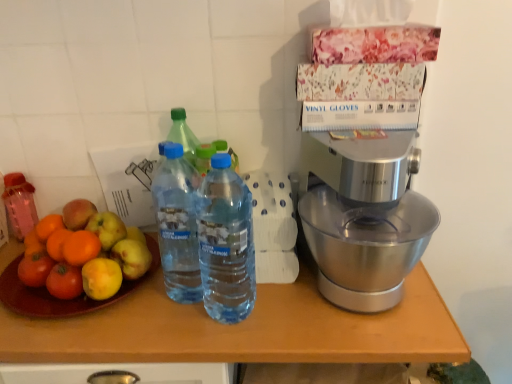
Question: Is blue plastic bottle at center, which is counted as the second bottle, starting from the back, smaller than pink translucent bottle at left, arranged as the third bottle when viewed from the right?

Choices:
 (A) yes
 (B) no

Answer: (B)

Question: Is blue plastic bottle at center, placed as the second bottle when sorted from right to left, facing away from pink translucent bottle at left, placed as the 1th bottle when sorted from left to right?

Choices:
 (A) no
 (B) yes

Answer: (A)

Question: Could you tell me if blue plastic bottle at center, placed as the second bottle when sorted from right to left, is facing pink translucent bottle at left, arranged as the third bottle when viewed from the right?

Choices:
 (A) no
 (B) yes

Answer: (A)

Question: Would you say blue plastic bottle at center, positioned as the second bottle in left-to-right order, is outside pink translucent bottle at left, arranged as the third bottle when viewed from the right?

Choices:
 (A) yes
 (B) no

Answer: (A)

Question: Is the position of blue plastic bottle at center, which is counted as the second bottle, starting from the back, less distant than that of pink translucent bottle at left, placed as the 1th bottle when sorted from left to right?

Choices:
 (A) yes
 (B) no

Answer: (A)

Question: Would you say blue plastic bottle at center, placed as the second bottle when sorted from right to left, is to the left or to the right of silver metallic mixer at right in the picture?

Choices:
 (A) right
 (B) left

Answer: (B)

Question: Does point (201, 294) appear closer or farther from the camera than point (322, 137)?

Choices:
 (A) closer
 (B) farther

Answer: (B)

Question: From the image's perspective, is blue plastic bottle at center, placed as the second bottle when sorted from front to back, above or below silver metallic mixer at right?

Choices:
 (A) below
 (B) above

Answer: (A)

Question: Is blue plastic bottle at center, which is counted as the second bottle, starting from the back, wider or thinner than silver metallic mixer at right?

Choices:
 (A) thin
 (B) wide

Answer: (A)

Question: In the image, is silver metallic mixer at right positioned in front of or behind transparent plastic bottle at center, which is counted as the 3th bottle, starting from the left?

Choices:
 (A) behind
 (B) front

Answer: (A)

Question: Considering the positions of silver metallic mixer at right and transparent plastic bottle at center, the first bottle positioned from the right, in the image, is silver metallic mixer at right taller or shorter than transparent plastic bottle at center, the first bottle positioned from the right,?

Choices:
 (A) short
 (B) tall

Answer: (A)

Question: In terms of width, does silver metallic mixer at right look wider or thinner when compared to transparent plastic bottle at center, the first bottle positioned from the right?

Choices:
 (A) wide
 (B) thin

Answer: (A)

Question: From the image's perspective, is silver metallic mixer at right located above or below transparent plastic bottle at center, which is counted as the 3th bottle, starting from the left?

Choices:
 (A) below
 (B) above

Answer: (B)

Question: Considering the positions of point (68, 369) and point (203, 185), is point (68, 369) closer or farther from the camera than point (203, 185)?

Choices:
 (A) farther
 (B) closer

Answer: (B)

Question: In terms of size, does wooden table at center appear bigger or smaller than transparent plastic bottle at center, acting as the 3th bottle starting from the back?

Choices:
 (A) small
 (B) big

Answer: (B)